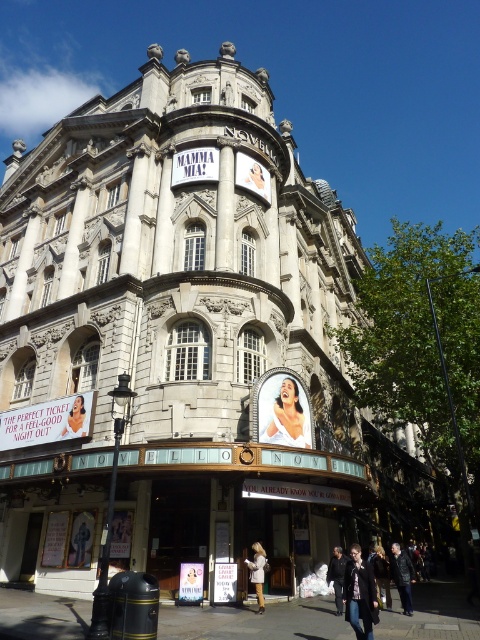
Can you confirm if dark gray jacket at center is positioned to the left of white cotton jacket at center?

In fact, dark gray jacket at center is to the right of white cotton jacket at center.

Does dark gray jacket at center have a greater width compared to white cotton jacket at center?

Yes.

Who is more forward, [380,602] or [337,600]?

Point [337,600]

Where is `dark gray jacket at center`? The image size is (480, 640). dark gray jacket at center is located at coordinates (382, 576).

Does point (292, 392) come behind point (387, 605)?

Yes.

Is point (277, 429) less distant than point (382, 561)?

Yes.

Between point (296, 381) and point (386, 577), which one is positioned behind?

Positioned behind is point (386, 577).

This screenshot has width=480, height=640. Find the location of `white glossy dress at center`. white glossy dress at center is located at coordinates (287, 417).

Which is above, dark blue jeans at lower center or leather jacket at lower right?

dark blue jeans at lower center

In the scene shown: Does dark blue jeans at lower center appear on the left side of leather jacket at lower right?

Indeed, dark blue jeans at lower center is positioned on the left side of leather jacket at lower right.

Locate an element on the screen. The width and height of the screenshot is (480, 640). dark blue jeans at lower center is located at coordinates (360, 595).